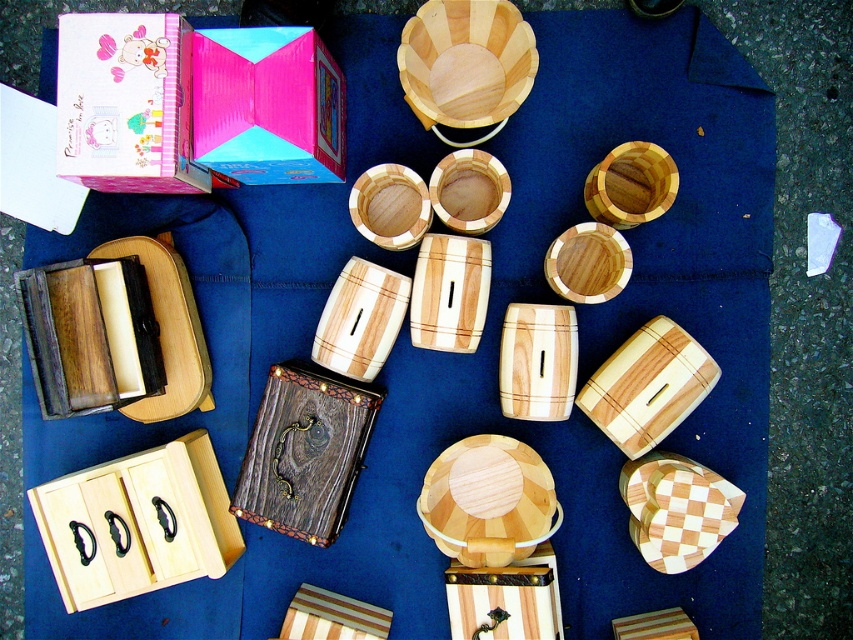
Question: Which object appears closest to the camera in this image?

Choices:
 (A) pink cardboard box at upper center
 (B) pink matte box at upper left
 (C) natural wood drawer at lower left

Answer: (B)

Question: Does natural wood drawer at lower left appear on the left side of pink matte box at upper left?

Choices:
 (A) no
 (B) yes

Answer: (B)

Question: Where is pink matte box at upper left located in relation to pink cardboard box at upper center in the image?

Choices:
 (A) below
 (B) above

Answer: (B)

Question: Which object is positioned closest to the pink cardboard box at upper center?

Choices:
 (A) natural wood drawer at lower left
 (B) pink matte box at upper left

Answer: (B)

Question: Can you confirm if natural wood drawer at lower left is wider than pink cardboard box at upper center?

Choices:
 (A) yes
 (B) no

Answer: (A)

Question: Which of the following is the closest to the observer?

Choices:
 (A) pink matte box at upper left
 (B) natural wood drawer at lower left

Answer: (A)